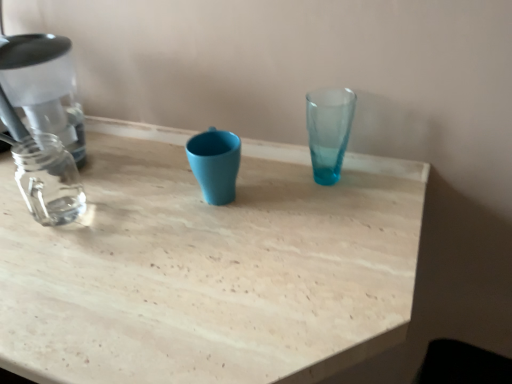
Question: Looking at their shapes, would you say light wood table at center is wider or thinner than translucent glass vase at upper center?

Choices:
 (A) wide
 (B) thin

Answer: (A)

Question: In terms of height, does light wood table at center look taller or shorter compared to translucent glass vase at upper center?

Choices:
 (A) short
 (B) tall

Answer: (B)

Question: Does point (111, 231) appear closer or farther from the camera than point (344, 99)?

Choices:
 (A) closer
 (B) farther

Answer: (A)

Question: In terms of width, does translucent glass vase at upper center look wider or thinner when compared to light wood table at center?

Choices:
 (A) wide
 (B) thin

Answer: (B)

Question: Is translucent glass vase at upper center in front of or behind light wood table at center in the image?

Choices:
 (A) front
 (B) behind

Answer: (B)

Question: Based on their sizes in the image, would you say translucent glass vase at upper center is bigger or smaller than light wood table at center?

Choices:
 (A) small
 (B) big

Answer: (A)

Question: From a real-world perspective, relative to light wood table at center, is translucent glass vase at upper center vertically above or below?

Choices:
 (A) below
 (B) above

Answer: (B)